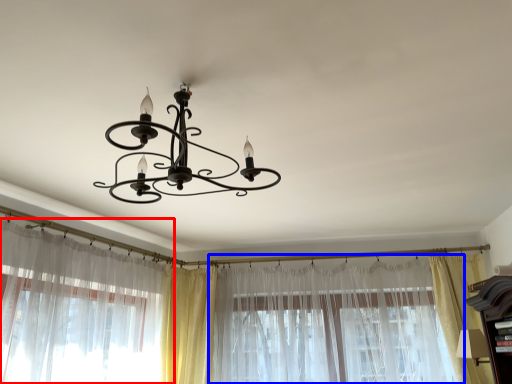
Question: Which of the following is the farthest to the observer, curtain (highlighted by a red box) or curtain (highlighted by a blue box)?

Choices:
 (A) curtain
 (B) curtain

Answer: (B)